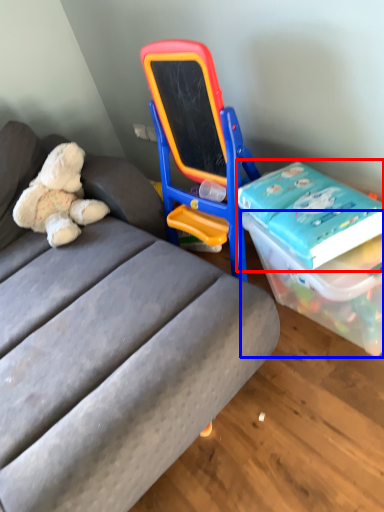
Question: Which point is closer to the camera, book (highlighted by a red box) or box (highlighted by a blue box)?

Choices:
 (A) book
 (B) box

Answer: (B)